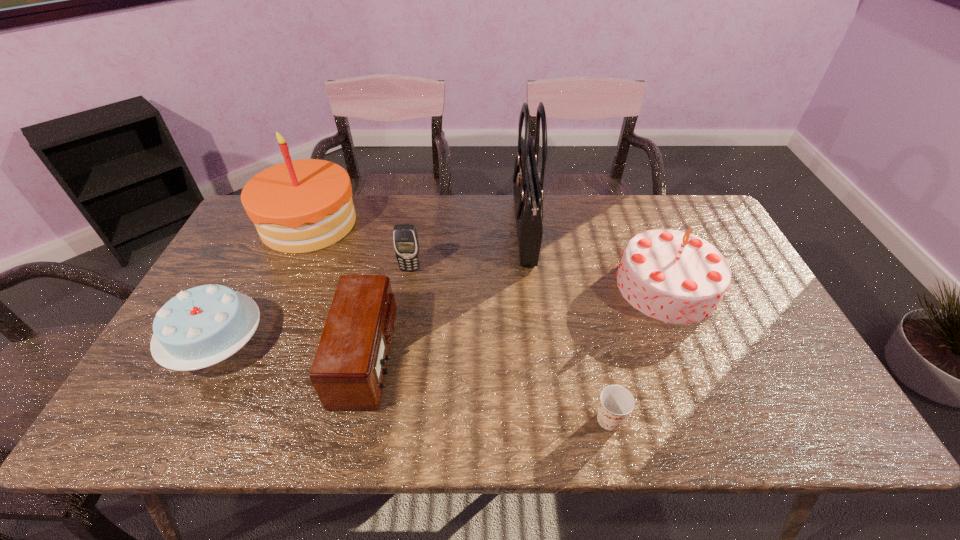
Image resolution: width=960 pixels, height=540 pixels. I want to click on vacant point located 0.320m with an open clasp on the front of the handbag, so click(413, 231).

Locate an element on the screen. The image size is (960, 540). free spot located 0.300m with an open clasp on the front of the handbag is located at coordinates (420, 231).

I want to click on vacant space situated with an open clasp on the front of the handbag, so click(x=485, y=231).

Find the location of `vacant space located 0.320m on the front of the second tallest object`. vacant space located 0.320m on the front of the second tallest object is located at coordinates (256, 341).

Find the location of a particular element. Image resolution: width=960 pixels, height=540 pixels. vacant area located on the left of the rightmost birthday cake is located at coordinates (503, 286).

Locate an element on the screen. This screenshot has width=960, height=540. vacant space located on the front face of the cellular telephone is located at coordinates (406, 295).

The image size is (960, 540). I want to click on vacant area located on the right of the shortest birthday cake, so click(x=318, y=343).

Identify the location of vacant space located on the front-facing side of the radio receiver. (436, 358).

Where is `vacant space located 0.060m on the right of the Dixie cup`? This screenshot has width=960, height=540. vacant space located 0.060m on the right of the Dixie cup is located at coordinates (653, 419).

Where is `handbag that is at the far edge`? This screenshot has height=540, width=960. handbag that is at the far edge is located at coordinates (528, 194).